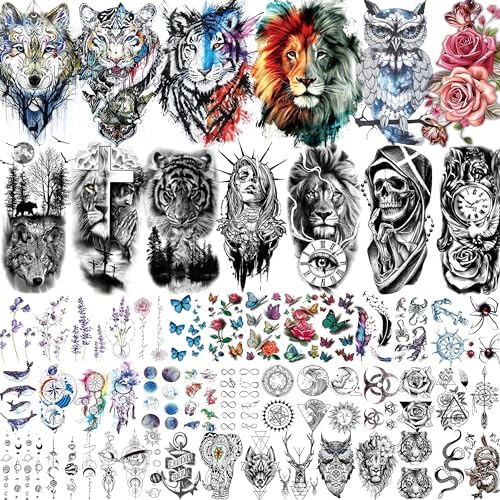
Locate an element on the screen. dreamcatcher is located at coordinates (95, 383).